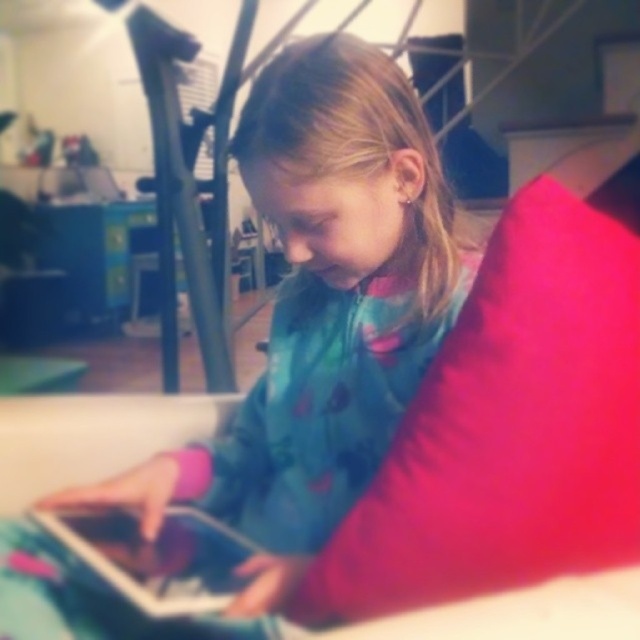
You are standing in the room where the girl is sitting with her tablet. There are two points marked on the floor at coordinates point (493, 566) and point (77, 509). If you want to place a small plant pot between these two points so that it is closer to the girl, which point should you position it near?

To place the plant pot closer to the girl, position it near point (493, 566) because it is in front of point (77, 509), meaning it is closer to the observer.